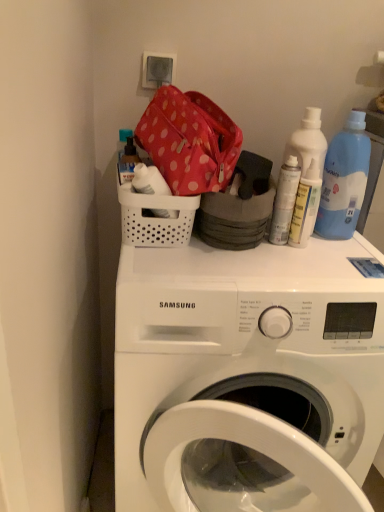
The height and width of the screenshot is (512, 384). In order to click on vacant area that is situated to the right of translucent plastic spray can at upper right, the 1th bottle positioned from the right in this screenshot , I will do `click(345, 248)`.